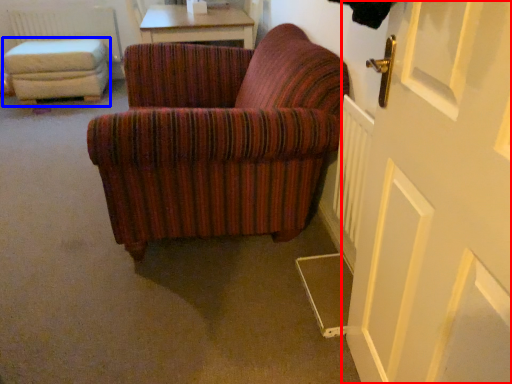
Question: Which object is closer to the camera taking this photo, door (highlighted by a red box) or stool (highlighted by a blue box)?

Choices:
 (A) door
 (B) stool

Answer: (A)